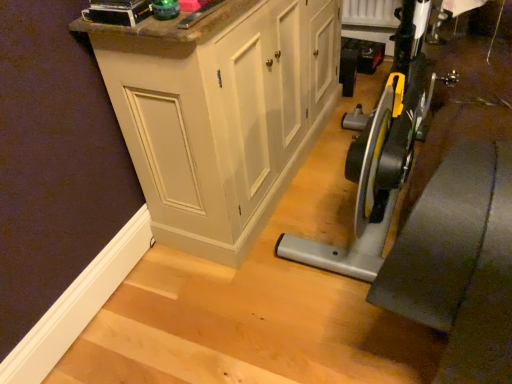
Question: Is matte white cabinet at center not inside green plastic bottle at upper center?

Choices:
 (A) no
 (B) yes

Answer: (B)

Question: Is matte white cabinet at center in contact with green plastic bottle at upper center?

Choices:
 (A) yes
 (B) no

Answer: (B)

Question: Is matte white cabinet at center bigger than green plastic bottle at upper center?

Choices:
 (A) no
 (B) yes

Answer: (B)

Question: Is matte white cabinet at center oriented towards green plastic bottle at upper center?

Choices:
 (A) yes
 (B) no

Answer: (B)

Question: Is the position of matte white cabinet at center less distant than that of green plastic bottle at upper center?

Choices:
 (A) yes
 (B) no

Answer: (B)

Question: Considering the relative positions of matte white cabinet at center and green plastic bottle at upper center in the image provided, is matte white cabinet at center to the right of green plastic bottle at upper center from the viewer's perspective?

Choices:
 (A) yes
 (B) no

Answer: (A)

Question: From a real-world perspective, does green plastic bottle at upper center sit lower than matte white cabinet at center?

Choices:
 (A) no
 (B) yes

Answer: (A)

Question: Could you tell me if green plastic bottle at upper center is facing matte white cabinet at center?

Choices:
 (A) yes
 (B) no

Answer: (B)

Question: Is green plastic bottle at upper center not close to matte white cabinet at center?

Choices:
 (A) no
 (B) yes

Answer: (A)

Question: Does green plastic bottle at upper center have a lesser width compared to matte white cabinet at center?

Choices:
 (A) yes
 (B) no

Answer: (A)

Question: Does green plastic bottle at upper center appear on the left side of matte white cabinet at center?

Choices:
 (A) yes
 (B) no

Answer: (A)

Question: From a real-world perspective, is green plastic bottle at upper center over matte white cabinet at center?

Choices:
 (A) no
 (B) yes

Answer: (B)

Question: Is green plastic bottle at upper center bigger or smaller than matte white cabinet at center?

Choices:
 (A) small
 (B) big

Answer: (A)